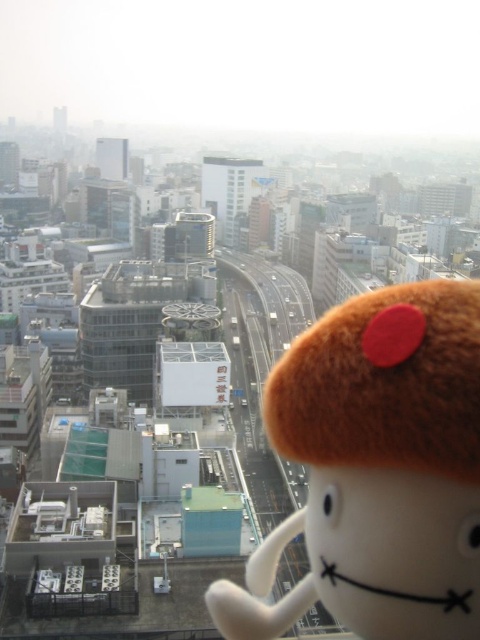
You are standing at the center of the image and want to place a new object at the same location as the brown plush toy at lower right. What are the coordinates where you should place it?

The coordinates for the brown plush toy at lower right are approximately 0.736 on the x axis and 0.785 on the y axis.